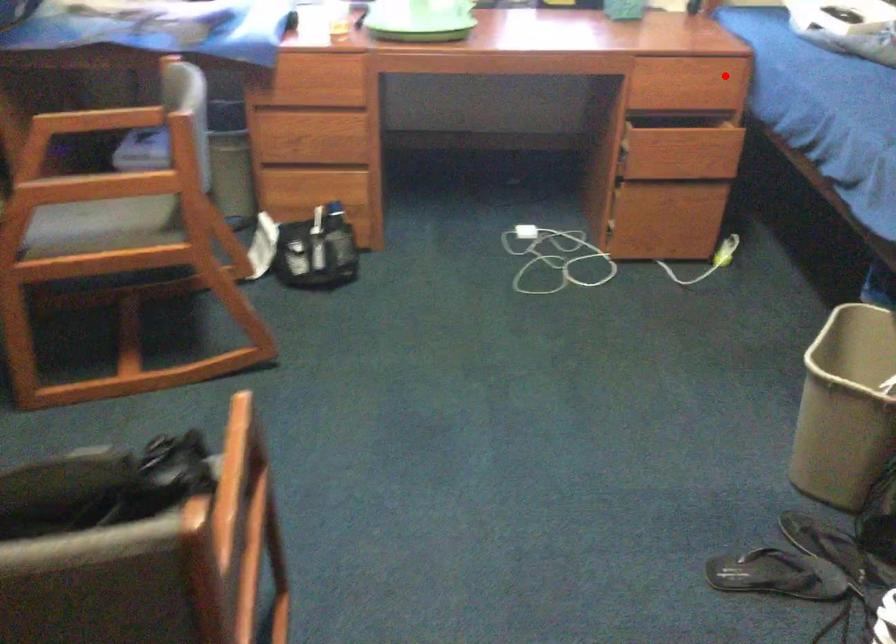
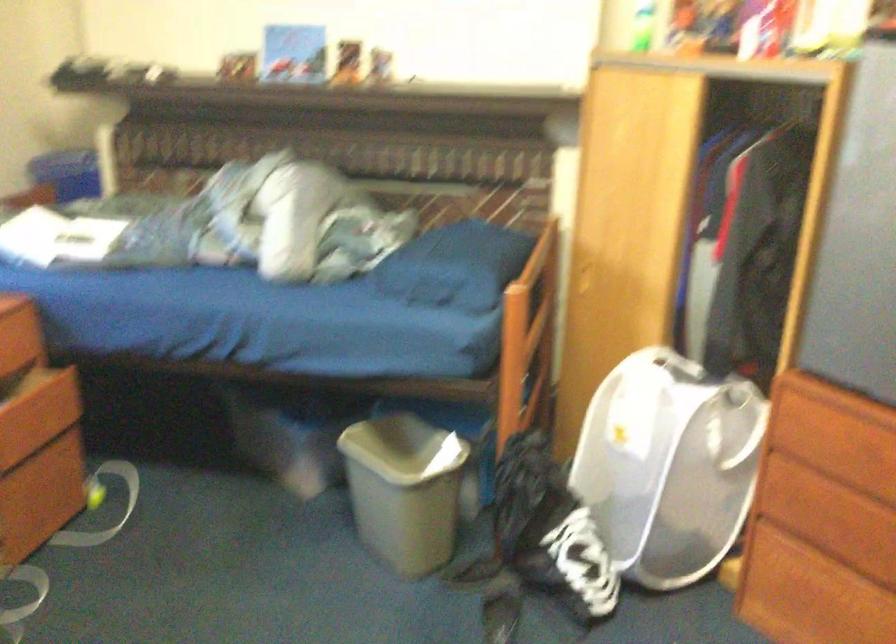
Locate, in the second image, the point that corresponds to the highlighted location in the first image.

(19, 332)